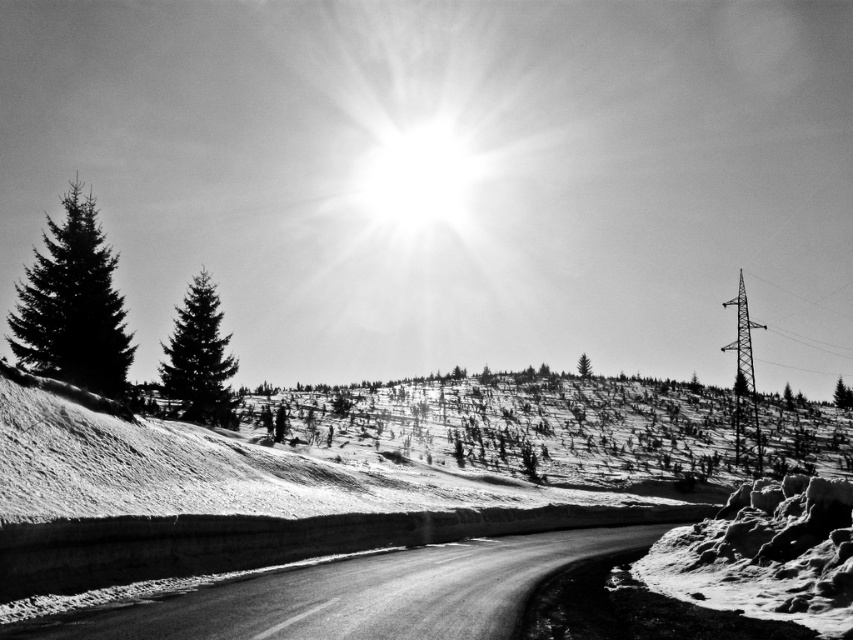
Can you confirm if smooth asphalt road at center is positioned to the left of dark green textured tree at center?

Indeed, smooth asphalt road at center is positioned on the left side of dark green textured tree at center.

Describe the element at coordinates (358, 595) in the screenshot. This screenshot has height=640, width=853. I see `smooth asphalt road at center` at that location.

You are a GUI agent. You are given a task and a screenshot of the screen. Output one action in this format:
    pyautogui.click(x=<x>, y=<y>)
    Task: Click on the smooth asphalt road at center
    Image resolution: width=853 pixels, height=640 pixels.
    Given the screenshot: What is the action you would take?
    click(x=358, y=595)

Is silvery textured pine tree at left bigger than dark green textured pine tree at upper left?

Yes.

Measure the distance between silvery textured pine tree at left and dark green textured pine tree at upper left.

580.31 feet

What do you see at coordinates (199, 356) in the screenshot?
I see `silvery textured pine tree at left` at bounding box center [199, 356].

Locate an element on the screen. This screenshot has height=640, width=853. silvery textured pine tree at left is located at coordinates (199, 356).

Can you confirm if smooth asphalt road at center is thinner than dark green textured pine tree at upper left?

Correct, smooth asphalt road at center's width is less than dark green textured pine tree at upper left's.

Is smooth asphalt road at center shorter than dark green textured pine tree at upper left?

Yes.

Who is more forward, (405, 556) or (840, 381)?

Point (405, 556)

Where is `smooth asphalt road at center`? This screenshot has height=640, width=853. smooth asphalt road at center is located at coordinates (358, 595).